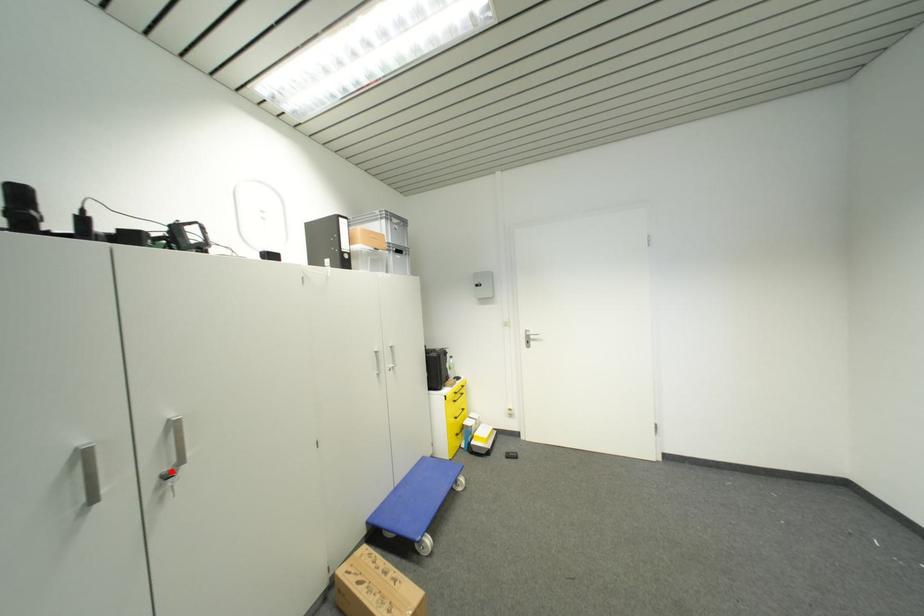
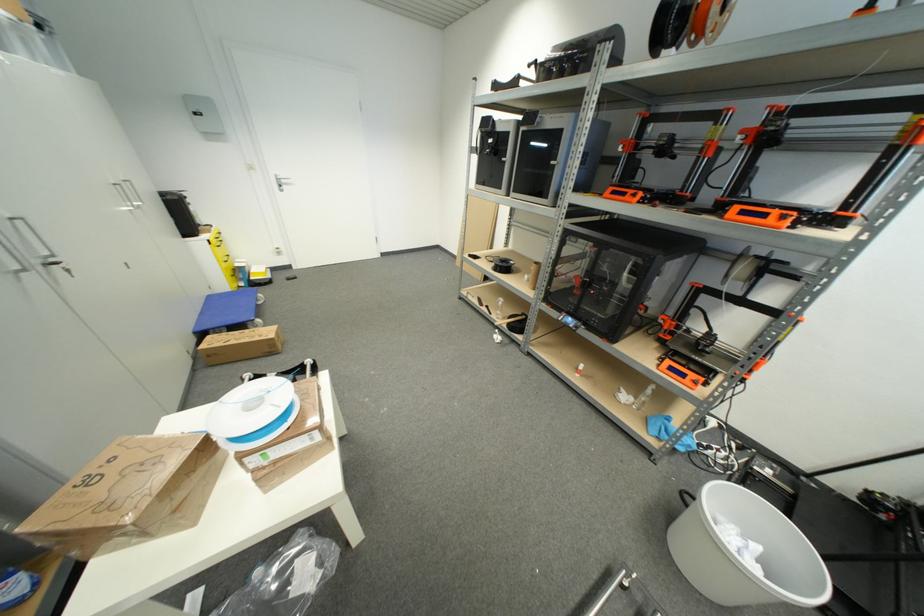
Question: I am providing you with two images of the same scene from different viewpoints. A red point is marked on the first image. At the location where the point appears in image 1, is it still visible in image 2?

Choices:
 (A) Yes
 (B) No

Answer: (A)